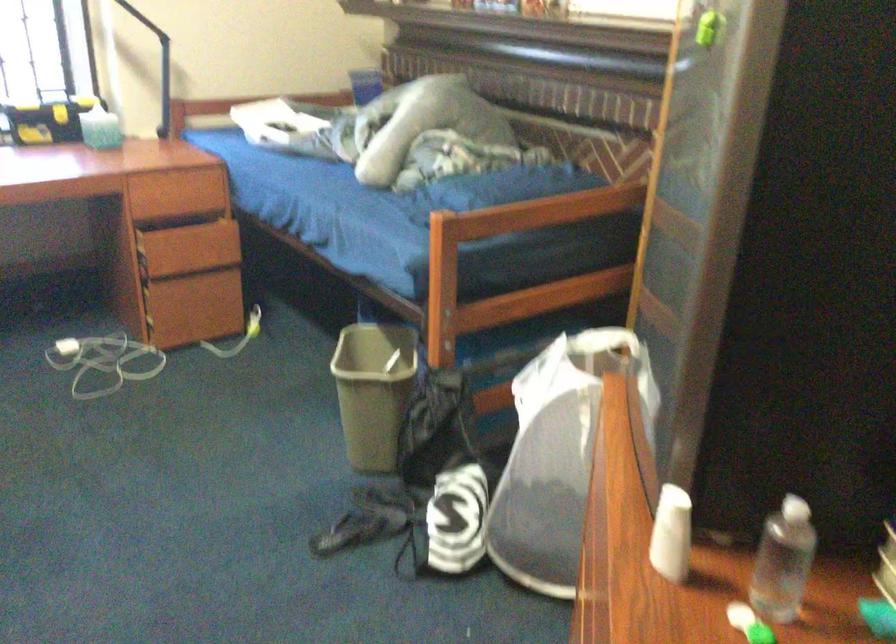
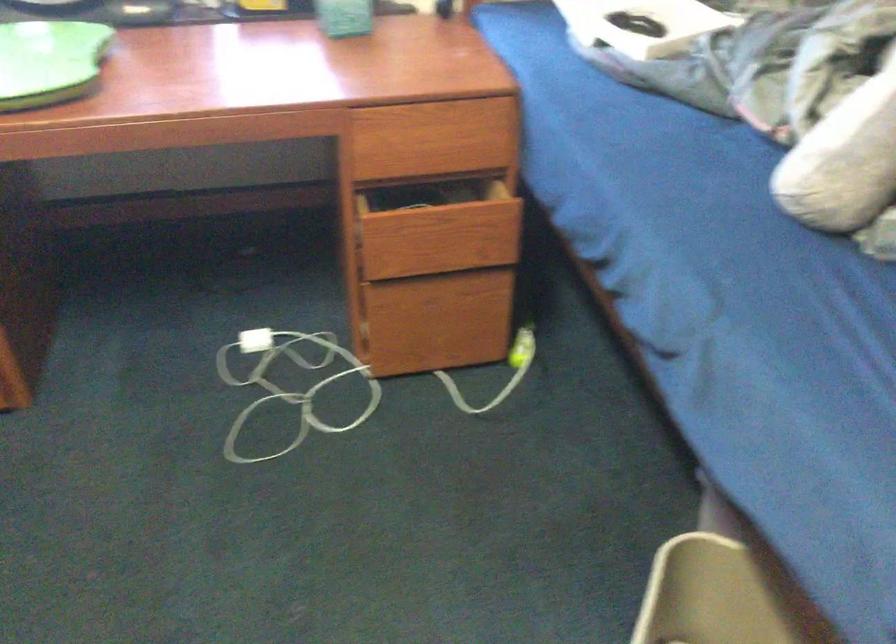
In the second image, find the point that corresponds to the point at 205,307 in the first image.

(455, 321)